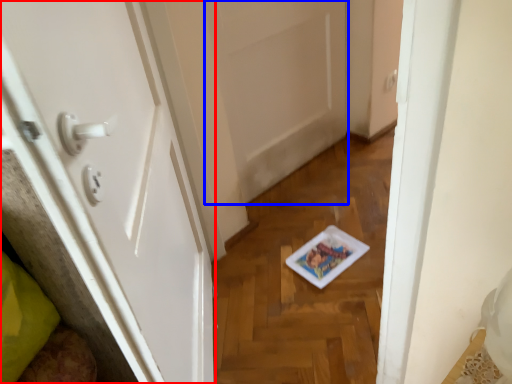
Question: Which of the following is the farthest to the observer, door (highlighted by a red box) or door (highlighted by a blue box)?

Choices:
 (A) door
 (B) door

Answer: (B)